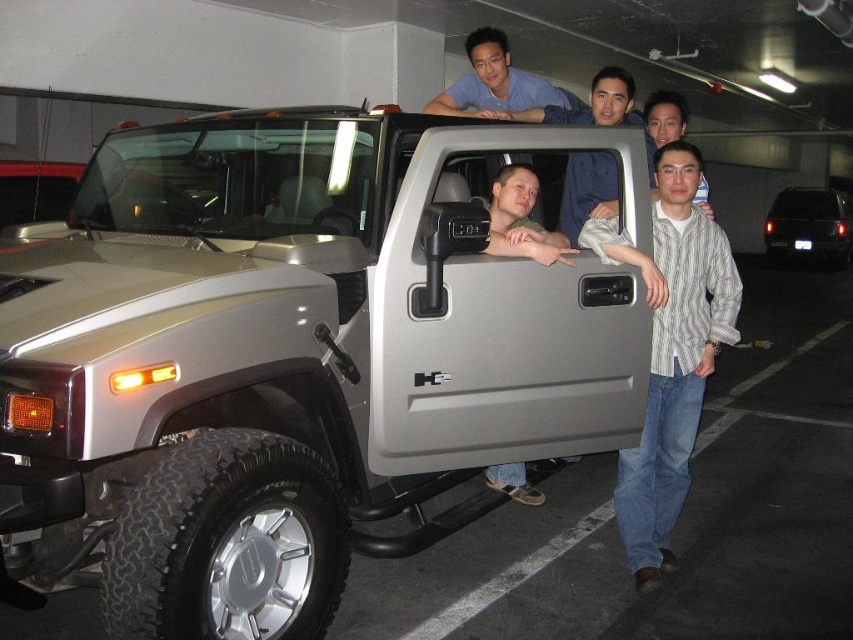
Based on the photo, does matte gray shirt at center appear over black glossy suv at right?

No.

At what (x,y) coordinates should I click in order to perform the action: click on matte gray shirt at center. Please return your answer as a coordinate pair (x, y). The width and height of the screenshot is (853, 640). Looking at the image, I should click on (595, 108).

Who is more distant from viewer, (x=602, y=124) or (x=810, y=196)?

Positioned behind is point (x=810, y=196).

I want to click on matte gray shirt at center, so [x=595, y=108].

Where is `matte blue shirt at upper center`? matte blue shirt at upper center is located at coordinates (497, 83).

Which is more to the right, matte blue shirt at upper center or black glossy suv at right?

Positioned to the right is black glossy suv at right.

Does point (541, 86) come farther from viewer compared to point (807, 234)?

That is False.

Find the location of `matte blue shirt at upper center`. matte blue shirt at upper center is located at coordinates (497, 83).

Which is in front, point (425, 372) or point (669, 275)?

Point (425, 372) is more forward.

Does satin silver jeep at center lie in front of striped cotton shirt at center?

Yes.

Is point (506, 403) behind point (698, 224)?

No, it is in front of (698, 224).

I want to click on satin silver jeep at center, so [292, 355].